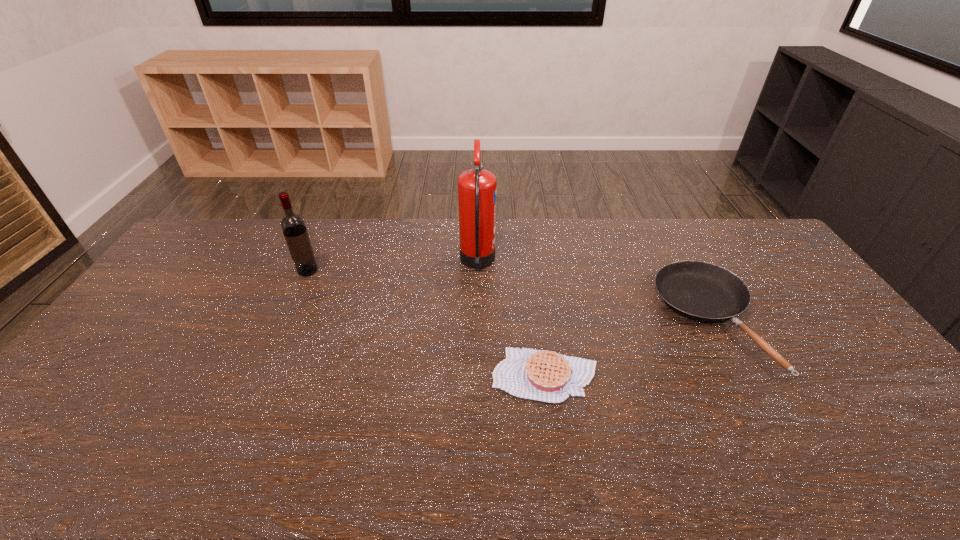
I want to click on free space that satisfies the following two spatial constraints: 1. on the back side of the rightmost object; 2. on the surface of the fire extinguisher, so click(x=680, y=263).

At what (x,y) coordinates should I click in order to perform the action: click on free spot that satisfies the following two spatial constraints: 1. on the front side of the rightmost object; 2. on the left side of the leftmost object. Please return your answer as a coordinate pair (x, y). The width and height of the screenshot is (960, 540). Looking at the image, I should click on (286, 320).

Where is `free space that satisfies the following two spatial constraints: 1. on the surface of the tallest object; 2. on the left side of the frying pan`? The height and width of the screenshot is (540, 960). free space that satisfies the following two spatial constraints: 1. on the surface of the tallest object; 2. on the left side of the frying pan is located at coordinates (477, 320).

You are a GUI agent. You are given a task and a screenshot of the screen. Output one action in this format:
    pyautogui.click(x=<x>, y=<y>)
    Task: Click on the vacant region that satisfies the following two spatial constraints: 1. on the surface of the tallest object; 2. on the left side of the pie
    The image size is (960, 540).
    Given the screenshot: What is the action you would take?
    pyautogui.click(x=477, y=375)